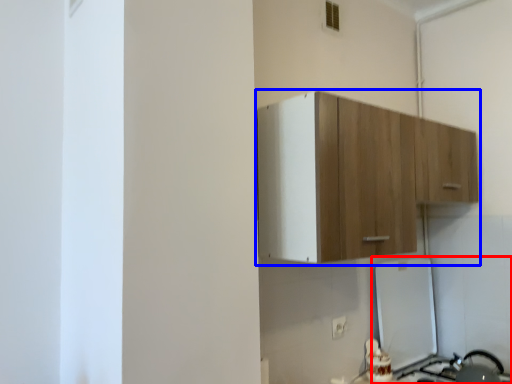
Question: Which object appears closest to the camera in this image, appliance (highlighted by a red box) or cabinetry (highlighted by a blue box)?

Choices:
 (A) appliance
 (B) cabinetry

Answer: (B)